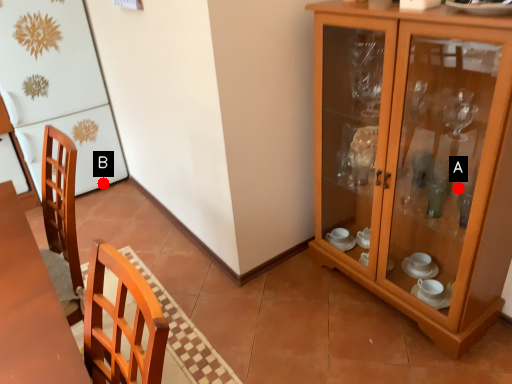
Question: Two points are circled on the image, labeled by A and B beside each circle. Which point is closer to the camera taking this photo?

Choices:
 (A) A is closer
 (B) B is closer

Answer: (A)